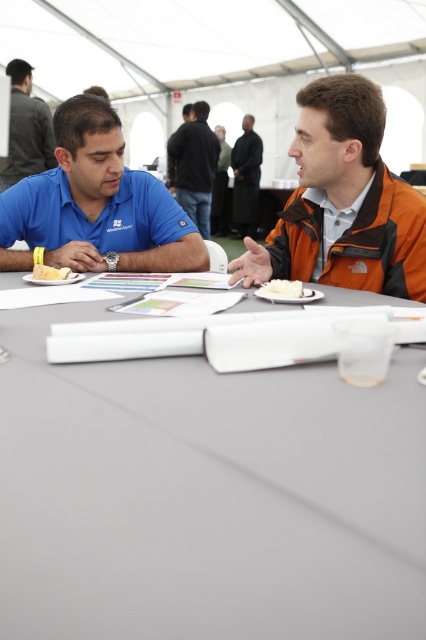
Does matte blue shirt at upper left have a smaller size compared to black leather jacket at center?

Indeed, matte blue shirt at upper left has a smaller size compared to black leather jacket at center.

Which is more to the right, matte blue shirt at upper left or black leather jacket at center?

From the viewer's perspective, black leather jacket at center appears more on the right side.

Is point (49, 138) farther from viewer compared to point (219, 141)?

No, it is in front of (219, 141).

Locate an element on the screen. This screenshot has width=426, height=640. matte blue shirt at upper left is located at coordinates (26, 129).

Between white matte table at center and matte blue shirt at left, which one has more height?

Standing taller between the two is matte blue shirt at left.

Can you confirm if white matte table at center is wider than matte blue shirt at left?

Indeed, white matte table at center has a greater width compared to matte blue shirt at left.

Which is in front, point (351, 508) or point (100, 216)?

Point (351, 508)

Image resolution: width=426 pixels, height=640 pixels. I want to click on white matte table at center, so click(207, 497).

Looking at this image, between matte blue shirt at upper left and white fluffy cake at center, which one is positioned lower?

Positioned lower is white fluffy cake at center.

You are a GUI agent. You are given a task and a screenshot of the screen. Output one action in this format:
    pyautogui.click(x=<x>, y=<y>)
    Task: Click on the matte blue shirt at upper left
    
    Given the screenshot: What is the action you would take?
    [26, 129]

The image size is (426, 640). I want to click on matte blue shirt at upper left, so click(x=26, y=129).